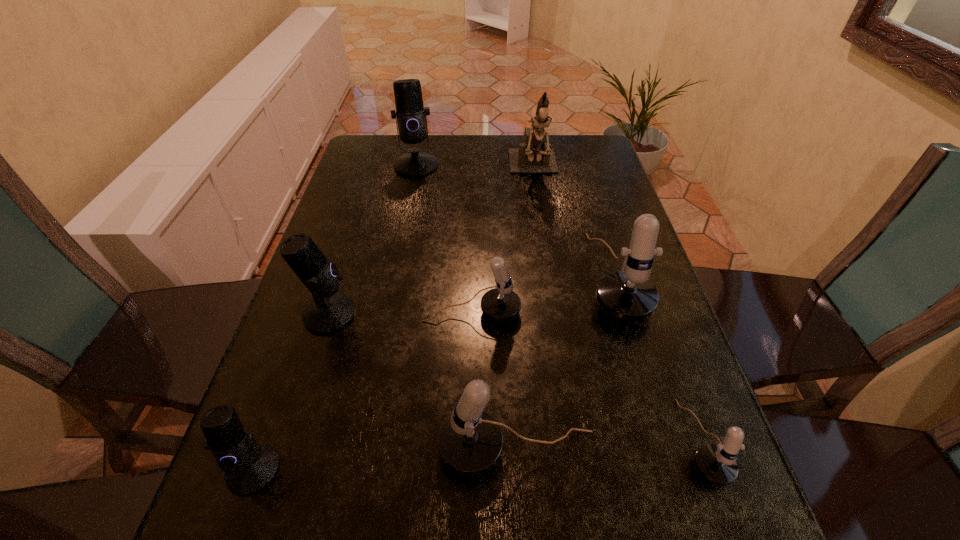
Where is `vacant space that's between the brown figurine and the sixth object from right to left`? The width and height of the screenshot is (960, 540). vacant space that's between the brown figurine and the sixth object from right to left is located at coordinates (475, 167).

You are a GUI agent. You are given a task and a screenshot of the screen. Output one action in this format:
    pyautogui.click(x=<x>, y=<y>)
    Task: Click on the unoccupied position between the second smallest white microphone and the nearest black microphone
    The width and height of the screenshot is (960, 540).
    Given the screenshot: What is the action you would take?
    pyautogui.click(x=362, y=391)

What are the coordinates of `free space between the brown figurine and the second biggest black microphone` in the screenshot? It's located at (431, 242).

Image resolution: width=960 pixels, height=540 pixels. In order to click on free space between the nearest black microphone and the figurine in this screenshot , I will do `click(394, 319)`.

Where is `object that can be found as the fifth closest to the brown figurine`? object that can be found as the fifth closest to the brown figurine is located at coordinates (717, 464).

Identify which object is the fifth nearest to the biggest white microphone. Please provide its 2D coordinates. Your answer should be formatted as a tuple, i.e. [(x, y)], where the tuple contains the x and y coordinates of a point satisfying the conditions above.

[(411, 115)]

Find the location of a particular element. microphone that can be found as the closest to the farthest microphone is located at coordinates point(628,295).

Identify which microphone is the nearest to the smallest white microphone. Please provide its 2D coordinates. Your answer should be formatted as a tuple, i.e. [(x, y)], where the tuple contains the x and y coordinates of a point satisfying the conditions above.

[(470, 442)]

Locate which black microphone ranks third in proximity to the second smallest white microphone. Please provide its 2D coordinates. Your answer should be formatted as a tuple, i.e. [(x, y)], where the tuple contains the x and y coordinates of a point satisfying the conditions above.

[(411, 115)]

Locate which black microphone ranks in proximity to the farthest microphone. Please provide its 2D coordinates. Your answer should be formatted as a tuple, i.e. [(x, y)], where the tuple contains the x and y coordinates of a point satisfying the conditions above.

[(328, 312)]